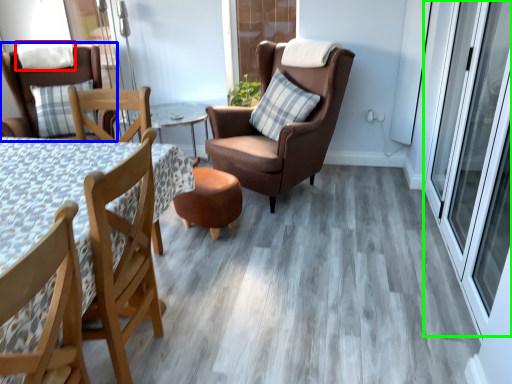
Question: Estimate the real-world distances between objects in this image. Which object is closer to pillow (highlighted by a red box), chair (highlighted by a blue box) or screen door (highlighted by a green box)?

Choices:
 (A) chair
 (B) screen door

Answer: (A)